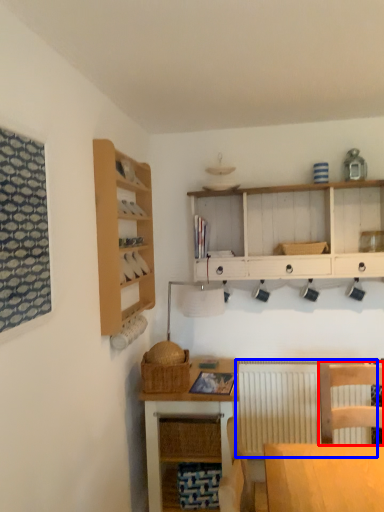
Question: Which object is closer to the camera taking this photo, chair (highlighted by a red box) or radiator (highlighted by a blue box)?

Choices:
 (A) chair
 (B) radiator

Answer: (A)